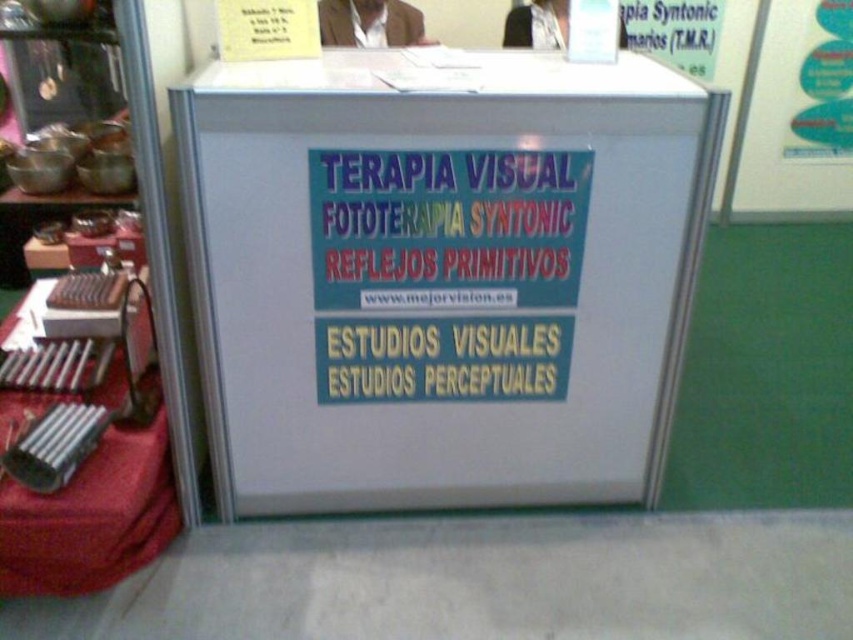
You are at an exhibition booth and need to place a small promotional item on either the metallic silver table at lower left or the white paper at upper right. Which surface is located lower in the image?

The metallic silver table at lower left is located below the white paper at upper right, so it is the lower surface in the image.

You are standing at the trade show booth and want to touch the point at coordinates point [288,252] on the display counter. If your arm is 2.5 feet long, can you reach it?

The point at point [288,252] is 5.01 feet away from you, which is farther than your arm length of 2.5 feet. Therefore, you cannot reach it with your arm.

You are setting up a booth for an event and need to place a narrow decorative strip along the edge of the metallic silver table at lower left and the white paper at upper right. Which object requires a wider strip?

The white paper at upper right requires a wider strip because it is thicker than the metallic silver table at lower left.